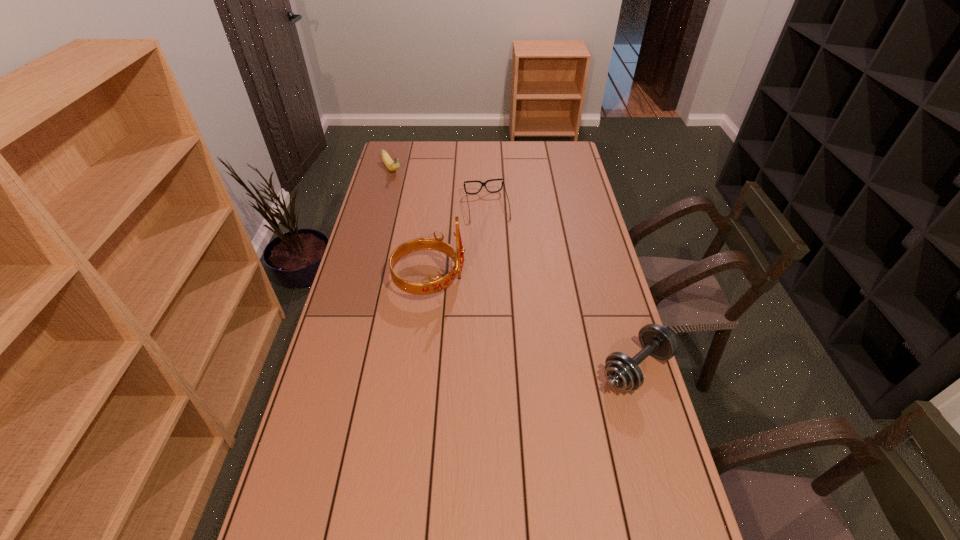
Where is `empty space between the nearest object and the shortest object`? The image size is (960, 540). empty space between the nearest object and the shortest object is located at coordinates (562, 288).

This screenshot has height=540, width=960. What are the coordinates of `free space between the leftmost object and the rightmost object` in the screenshot? It's located at (514, 269).

Identify which object is the second closest to the third farthest object. Please provide its 2D coordinates. Your answer should be formatted as a tuple, i.e. [(x, y)], where the tuple contains the x and y coordinates of a point satisfying the conditions above.

[(622, 372)]

The image size is (960, 540). In order to click on object identified as the second closest to the shortest object in this screenshot , I will do `click(392, 165)`.

The image size is (960, 540). I want to click on vacant region that satisfies the following two spatial constraints: 1. on the front side of the shortest object; 2. on the left side of the dumbbell, so click(x=490, y=368).

You are a GUI agent. You are given a task and a screenshot of the screen. Output one action in this format:
    pyautogui.click(x=<x>, y=<y>)
    Task: Click on the free space that satisfies the following two spatial constraints: 1. on the front side of the nearest object; 2. on the left side of the third nearest object
    The width and height of the screenshot is (960, 540).
    Given the screenshot: What is the action you would take?
    pyautogui.click(x=490, y=368)